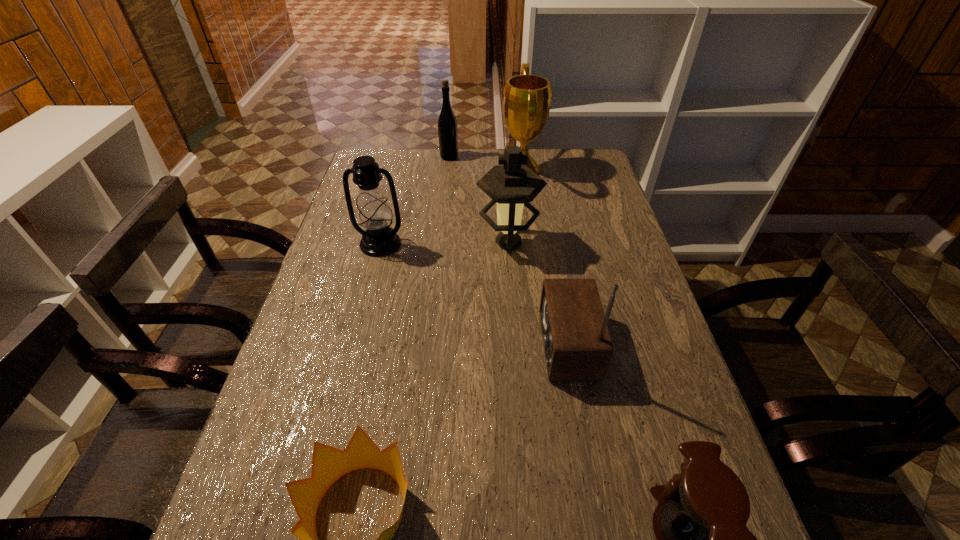
This screenshot has width=960, height=540. I want to click on vacant space situated on the back of the left oil lamp, so click(x=399, y=168).

Locate an element on the screen. Image resolution: width=960 pixels, height=540 pixels. vacant space located 0.320m on the front-facing side of the third nearest object is located at coordinates click(406, 344).

This screenshot has width=960, height=540. I want to click on free space located on the front-facing side of the third nearest object, so click(386, 344).

Locate an element on the screen. vacant space located 0.100m on the front-facing side of the third nearest object is located at coordinates (497, 344).

Locate an element on the screen. The height and width of the screenshot is (540, 960). award that is at the far edge is located at coordinates (527, 98).

You are a GUI agent. You are given a task and a screenshot of the screen. Output one action in this format:
    pyautogui.click(x=<x>, y=<y>)
    Task: Click on the beer bottle at the far edge
    Image resolution: width=960 pixels, height=540 pixels.
    Given the screenshot: What is the action you would take?
    pyautogui.click(x=447, y=124)

Find the location of a particular element. Image resolution: width=960 pixels, height=540 pixels. object that is at the left edge is located at coordinates pyautogui.click(x=374, y=214).

Where is `free location at the far edge`? This screenshot has width=960, height=540. free location at the far edge is located at coordinates (467, 159).

Where is `vacant space at the left edge of the desktop`? The image size is (960, 540). vacant space at the left edge of the desktop is located at coordinates (254, 485).

Find the location of a particular element. The height and width of the screenshot is (540, 960). vacant space at the right edge of the desktop is located at coordinates (604, 186).